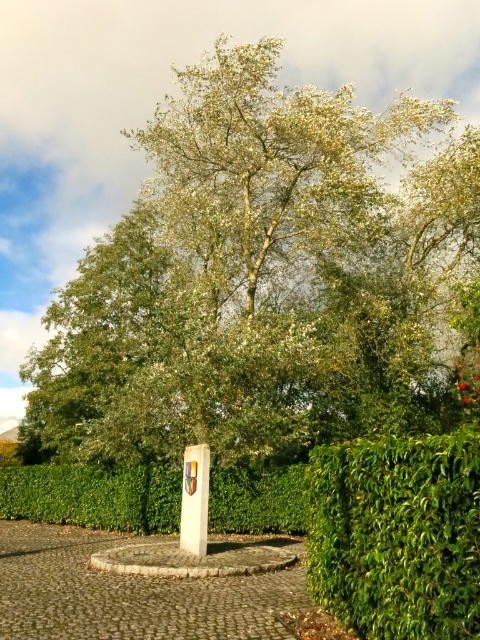
Question: Which point is farther to the camera?

Choices:
 (A) green leafy hedge at lower right
 (B) green leafy tree at center
 (C) green leafy hedge at center
 (D) white stone sign at center

Answer: (B)

Question: Can you confirm if green leafy tree at center is wider than white stone sign at center?

Choices:
 (A) yes
 (B) no

Answer: (A)

Question: Can you confirm if green leafy tree at center is positioned below white stone sign at center?

Choices:
 (A) no
 (B) yes

Answer: (A)

Question: Is green leafy hedge at center positioned at the back of white stone sign at center?

Choices:
 (A) no
 (B) yes

Answer: (B)

Question: Which point is closer to the camera?

Choices:
 (A) (414, 593)
 (B) (439, 406)
 (C) (14, 508)
 (D) (181, 506)

Answer: (A)

Question: Which point is farther to the camera?

Choices:
 (A) (394, 620)
 (B) (192, 550)
 (C) (86, 372)

Answer: (C)